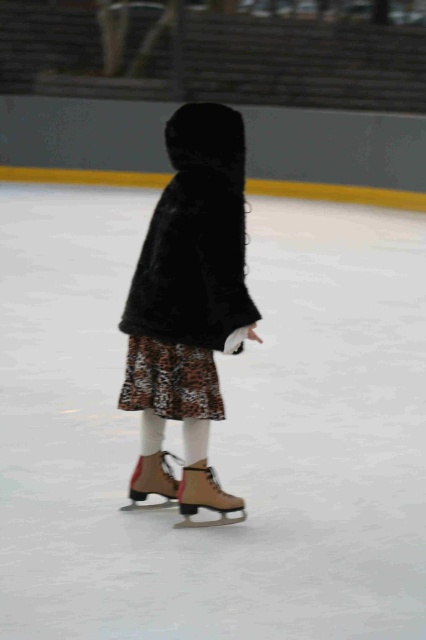
You are a parent trying to retrieve your child from the ice skating rink. Your child is wearing a skirt with leopard print and is standing near two roller skates. Which roller skate is positioned to the right of the other? The skates are labeled as brown leather roller skate at center and brown suede roller skate at center.

The brown leather roller skate at center is positioned to the right of the brown suede roller skate at center.

You are a skate rental attendant and need to determine if the brown leather roller skate at center and the brown suede roller skate at center can fit side by side on a 1.2 meter wide shelf. What should you check first?

You should check the combined width of the brown leather roller skate at center and the brown suede roller skate at center. Since the brown leather roller skate at center is wider than the brown suede roller skate at center, their total width must be compared to the 1.2 meter shelf to ensure they fit side by side.

The child is standing on the white ice at center and wearing the brown suede roller skate at center. Which object is closer to the front of the image?

The white ice at center is in front of the brown suede roller skate at center, so the white ice at center is closer to the front of the image.